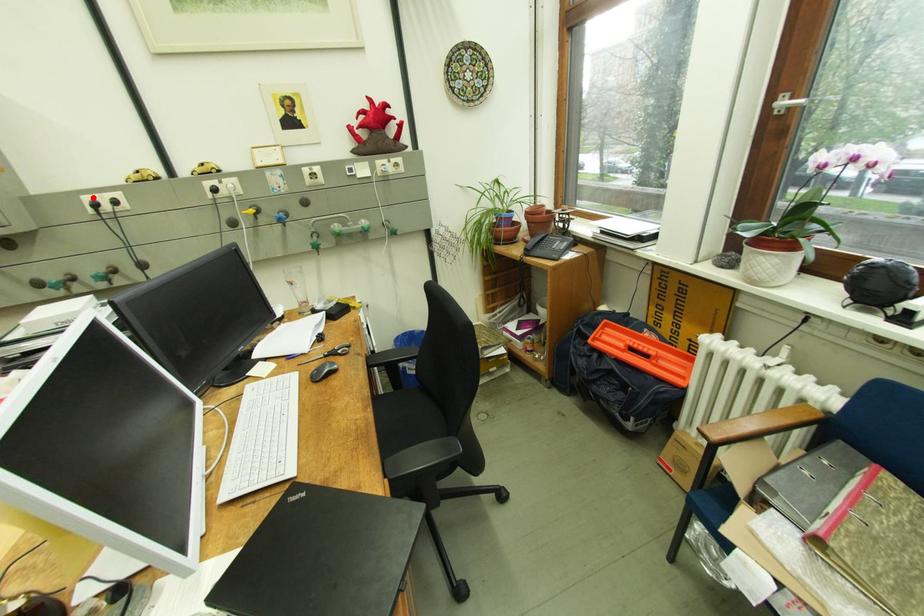
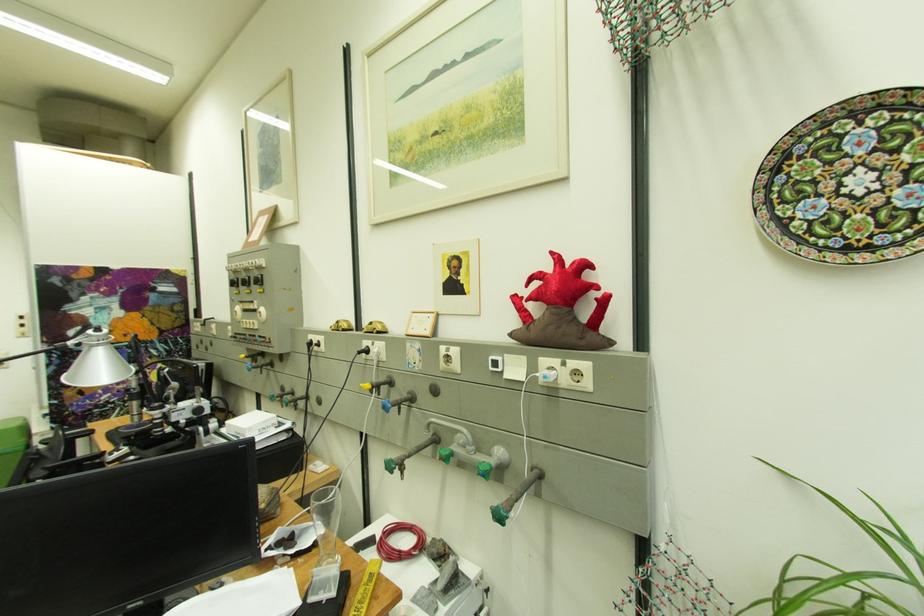
Find the pixel in the second image that matches the highlighted location in the first image.

(320, 336)